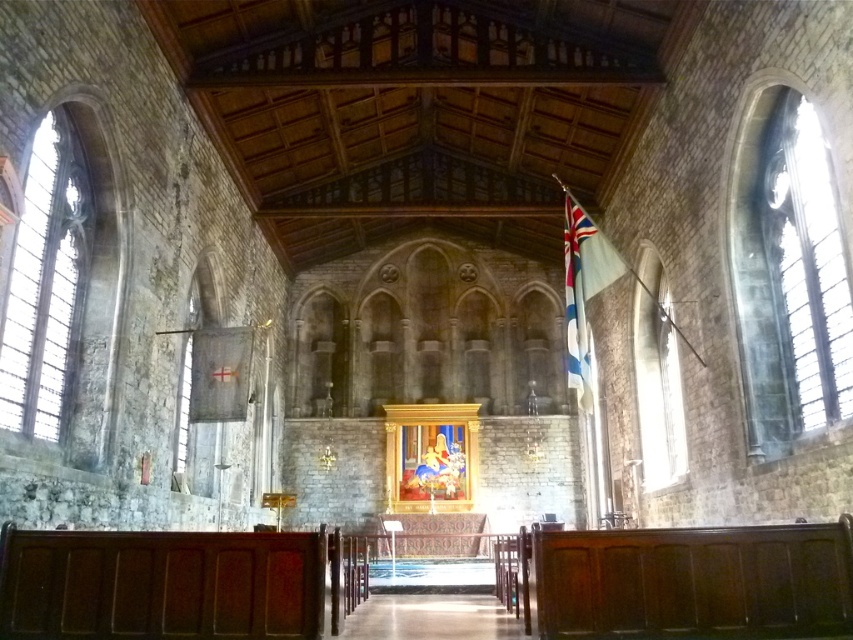
Question: Which object is the farthest from the clear glass window at left?

Choices:
 (A) white fabric flag at upper right
 (B) clear glass window at right

Answer: (B)

Question: Estimate the real-world distances between objects in this image. Which object is closer to the clear glass window at left?

Choices:
 (A) clear glass window at right
 (B) white fabric flag at upper right

Answer: (B)

Question: Does clear glass window at right have a lesser width compared to white fabric flag at upper right?

Choices:
 (A) yes
 (B) no

Answer: (A)

Question: Which of the following is the closest to the observer?

Choices:
 (A) (67, 157)
 (B) (584, 356)

Answer: (A)

Question: Considering the relative positions of clear glass window at right and clear glass window at left in the image provided, where is clear glass window at right located with respect to clear glass window at left?

Choices:
 (A) left
 (B) right

Answer: (B)

Question: Where is clear glass window at right located in relation to white fabric flag at upper right in the image?

Choices:
 (A) left
 (B) right

Answer: (B)